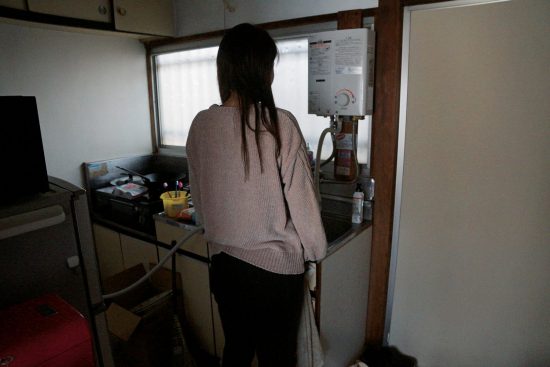
Image resolution: width=550 pixels, height=367 pixels. I want to click on black appliance sitting on table, so click(35, 157).